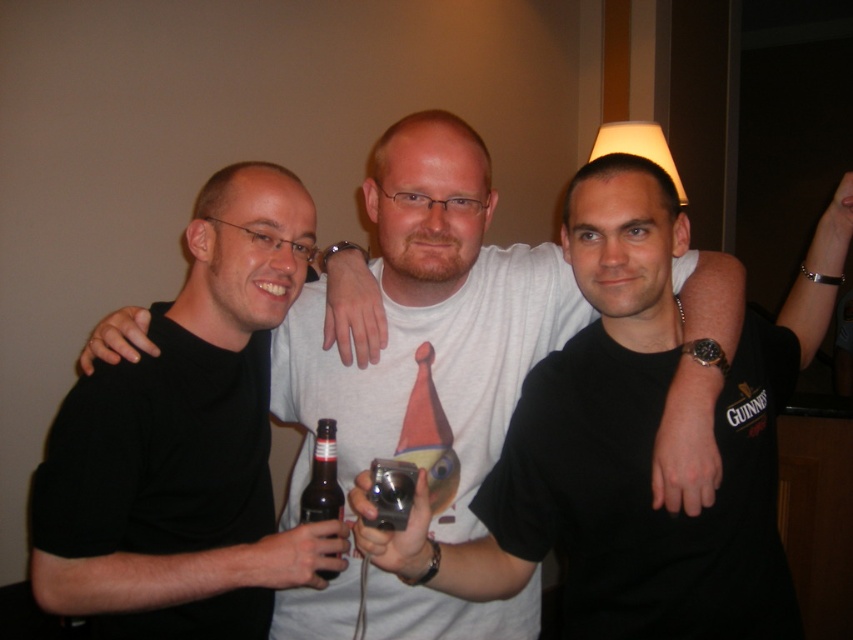
You are standing in the dimly lit room and want to find the black matte shirt at center. Based on the coordinates provided in the Objects Description, can you determine if it is positioned near the center of the image?

The black matte shirt at center is located at point coordinates approximately 0.491 in the x and 0.508 in the y, which are very close to the center coordinates of the image, so yes, it is positioned near the center of the image.